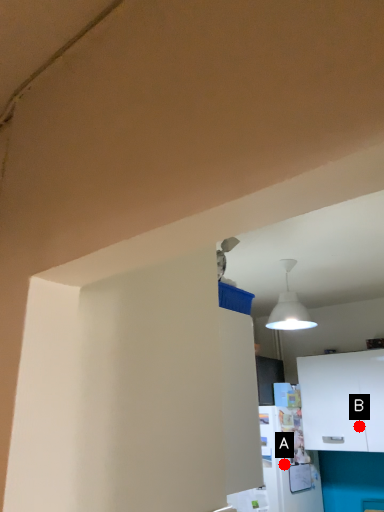
Question: Two points are circled on the image, labeled by A and B beside each circle. Which point appears closest to the camera in this image?

Choices:
 (A) A is closer
 (B) B is closer

Answer: (B)